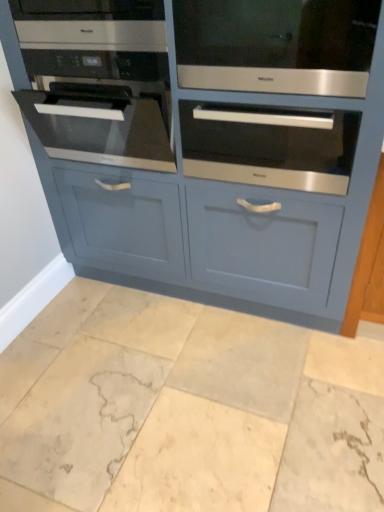
Question: Can you confirm if satin stainless steel oven at upper left is taller than matte blue cabinet at center?

Choices:
 (A) yes
 (B) no

Answer: (B)

Question: From a real-world perspective, is satin stainless steel oven at upper left positioned over matte blue cabinet at center based on gravity?

Choices:
 (A) no
 (B) yes

Answer: (B)

Question: Considering the relative positions of satin stainless steel oven at upper left and matte blue cabinet at center in the image provided, is satin stainless steel oven at upper left to the right of matte blue cabinet at center from the viewer's perspective?

Choices:
 (A) no
 (B) yes

Answer: (A)

Question: From the image's perspective, does satin stainless steel oven at upper left appear lower than matte blue cabinet at center?

Choices:
 (A) no
 (B) yes

Answer: (A)

Question: Is matte blue cabinet at center a part of satin stainless steel oven at upper left?

Choices:
 (A) yes
 (B) no

Answer: (B)

Question: Is satin black oven at left, placed as the first oven when sorted from left to right, wider or thinner than matte blue cabinet at center?

Choices:
 (A) thin
 (B) wide

Answer: (B)

Question: From their relative heights in the image, would you say satin black oven at left, placed as the first oven when sorted from left to right, is taller or shorter than matte blue cabinet at center?

Choices:
 (A) tall
 (B) short

Answer: (B)

Question: From a real-world perspective, is satin black oven at left, which is the 3th oven in right-to-left order, physically located above or below matte blue cabinet at center?

Choices:
 (A) above
 (B) below

Answer: (A)

Question: Visually, is satin black oven at left, which is the 3th oven in right-to-left order, positioned to the left or to the right of matte blue cabinet at center?

Choices:
 (A) right
 (B) left

Answer: (B)

Question: Considering the positions of satin black oven at left, placed as the first oven when sorted from left to right, and marble tile at lower center in the image, is satin black oven at left, placed as the first oven when sorted from left to right, taller or shorter than marble tile at lower center?

Choices:
 (A) tall
 (B) short

Answer: (A)

Question: Would you say satin black oven at left, placed as the first oven when sorted from left to right, is to the left or to the right of marble tile at lower center in the picture?

Choices:
 (A) right
 (B) left

Answer: (B)

Question: From a real-world perspective, is satin black oven at left, which is the 3th oven in right-to-left order, above or below marble tile at lower center?

Choices:
 (A) below
 (B) above

Answer: (B)

Question: From the image's perspective, is satin black oven at left, which is the 3th oven in right-to-left order, located above or below marble tile at lower center?

Choices:
 (A) below
 (B) above

Answer: (B)

Question: In the image, is satin silver oven at center, the 1th oven from the right, on the left side or the right side of marble tile at lower center?

Choices:
 (A) right
 (B) left

Answer: (A)

Question: Considering the positions of satin silver oven at center, the 1th oven from the right, and marble tile at lower center in the image, is satin silver oven at center, the 1th oven from the right, wider or thinner than marble tile at lower center?

Choices:
 (A) thin
 (B) wide

Answer: (A)